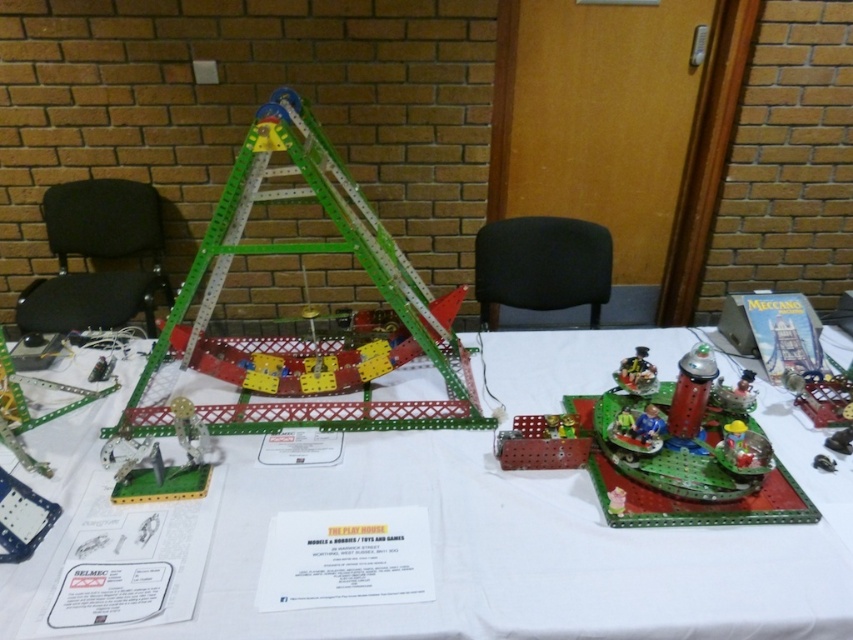
Is black fabric chair at left wider than black fabric chair at center?

Yes.

Which of these two, black fabric chair at left or black fabric chair at center, stands shorter?

black fabric chair at center is shorter.

Is point (140, 202) less distant than point (554, 268)?

No, (140, 202) is behind (554, 268).

Find the location of `black fabric chair at left`. black fabric chair at left is located at coordinates (97, 257).

Does green plastic ladder at center appear under metallic green tower at center?

Actually, green plastic ladder at center is above metallic green tower at center.

Does green plastic ladder at center have a greater height compared to metallic green tower at center?

Result: Indeed, green plastic ladder at center has a greater height compared to metallic green tower at center.

Is point (254, 404) in front of point (651, 390)?

Yes.

At what (x,y) coordinates should I click in order to perform the action: click on green plastic ladder at center. Please return your answer as a coordinate pair (x, y). Looking at the image, I should click on (310, 323).

Who is taller, green plastic toy at center or metallic green tower at center?

green plastic toy at center is taller.

Which is in front, point (592, 417) or point (625, 385)?

Point (625, 385) is in front.

The height and width of the screenshot is (640, 853). I want to click on green plastic toy at center, so (x=682, y=465).